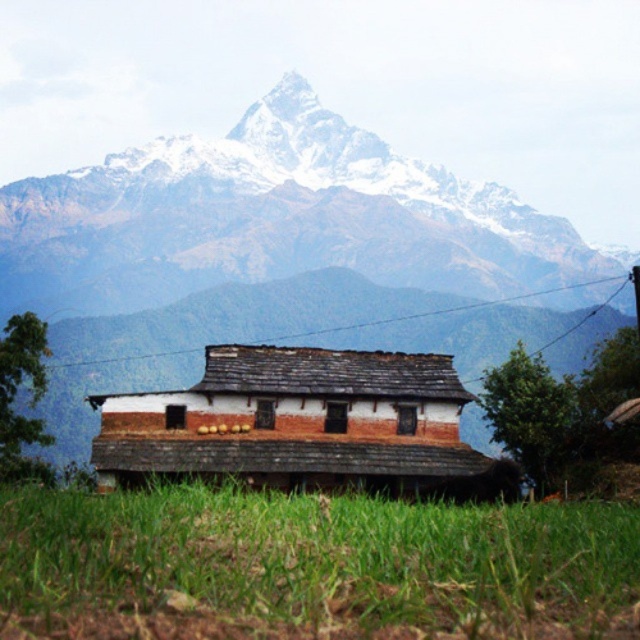
You are a landscape architect planning to install a new garden pathway between the snowy granite mountain range at upper center and the green grass at lower center. Which area should you prioritize for the pathway to ensure it is more visible from the house?

The snowy granite mountain range at upper center should be prioritized because it might be wider than the green grass at lower center, making it more prominent in the landscape and ensuring better visibility from the house.